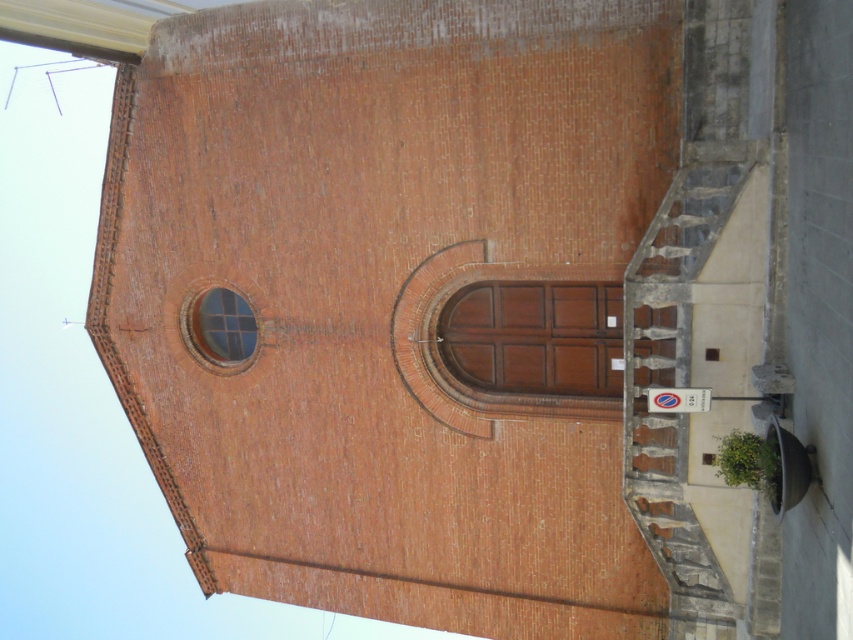
Question: Does matte brown door at center have a smaller size compared to clear glass window at upper left?

Choices:
 (A) no
 (B) yes

Answer: (A)

Question: Does matte brown door at center appear under clear glass window at upper left?

Choices:
 (A) no
 (B) yes

Answer: (B)

Question: Which of the following is the farthest from the observer?

Choices:
 (A) matte brown door at center
 (B) clear glass window at upper left

Answer: (B)

Question: Among these objects, which one is nearest to the camera?

Choices:
 (A) clear glass window at upper left
 (B) matte brown door at center

Answer: (B)

Question: Observing the image, what is the correct spatial positioning of matte brown door at center in reference to clear glass window at upper left?

Choices:
 (A) left
 (B) right

Answer: (B)

Question: Which of the following is the farthest from the observer?

Choices:
 (A) matte brown door at center
 (B) clear glass window at upper left

Answer: (B)